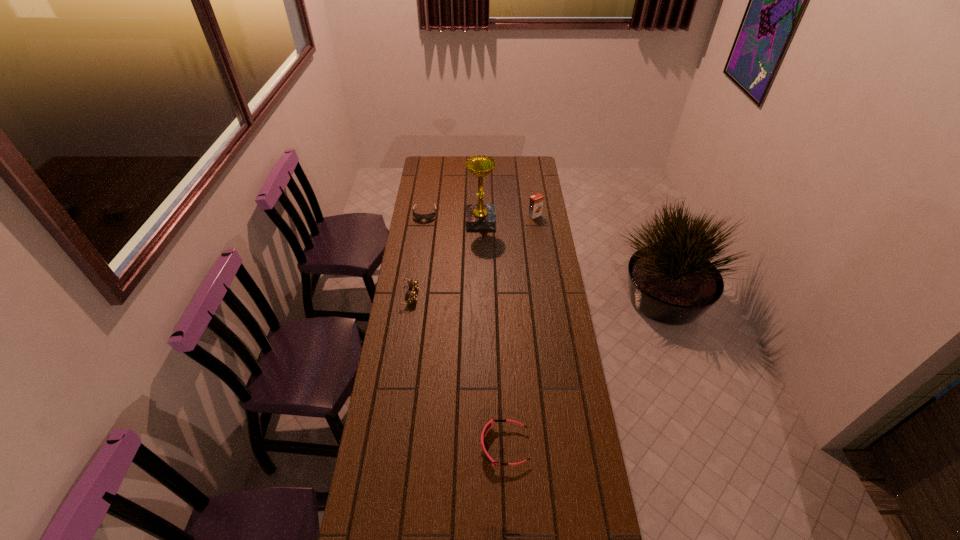
Choose which object is the fourth nearest neighbor to the shortest object. Please provide its 2D coordinates. Your answer should be formatted as a tuple, i.e. [(x, y)], where the tuple contains the x and y coordinates of a point satisfying the conditions above.

[(489, 424)]

The height and width of the screenshot is (540, 960). I want to click on object that ranks as the third closest to the award, so click(411, 296).

Point out which goggles is positioned as the nearest to the orange juice. Please provide its 2D coordinates. Your answer should be formatted as a tuple, i.e. [(x, y)], where the tuple contains the x and y coordinates of a point satisfying the conditions above.

[(430, 216)]

Identify the location of goggles identified as the closest to the award. (430, 216).

Identify the location of free spot that satisfies the following two spatial constraints: 1. on the front and sides of the shortest goggles; 2. on the right side of the fourth shortest object. (424, 215).